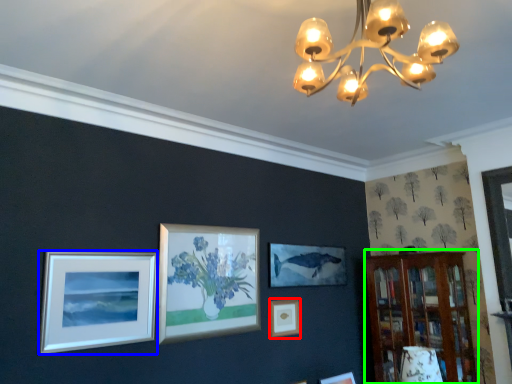
Question: Based on their relative distances, which object is nearer to picture frame (highlighted by a red box)? Choose from picture frame (highlighted by a blue box) and bookshelf (highlighted by a green box).

Choices:
 (A) picture frame
 (B) bookshelf

Answer: (B)